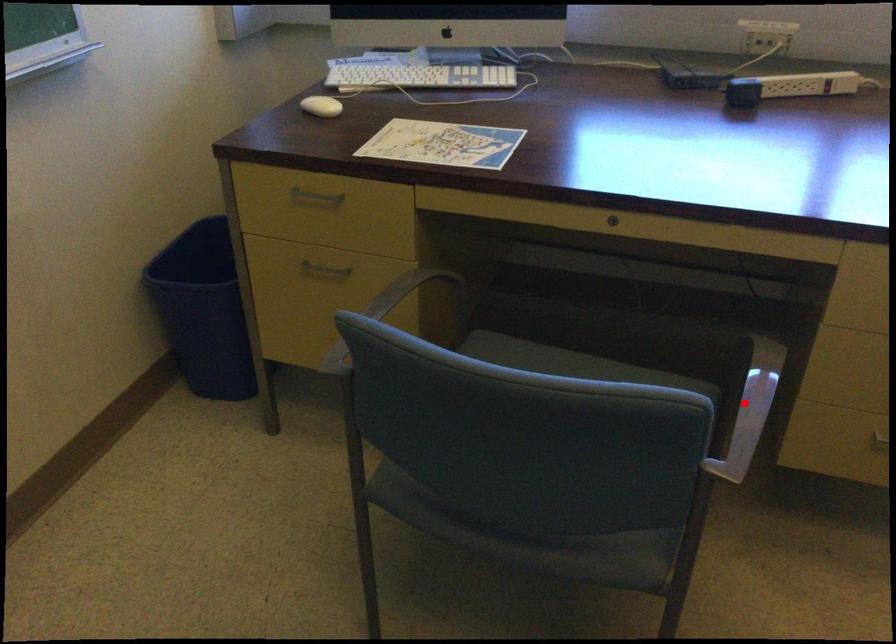
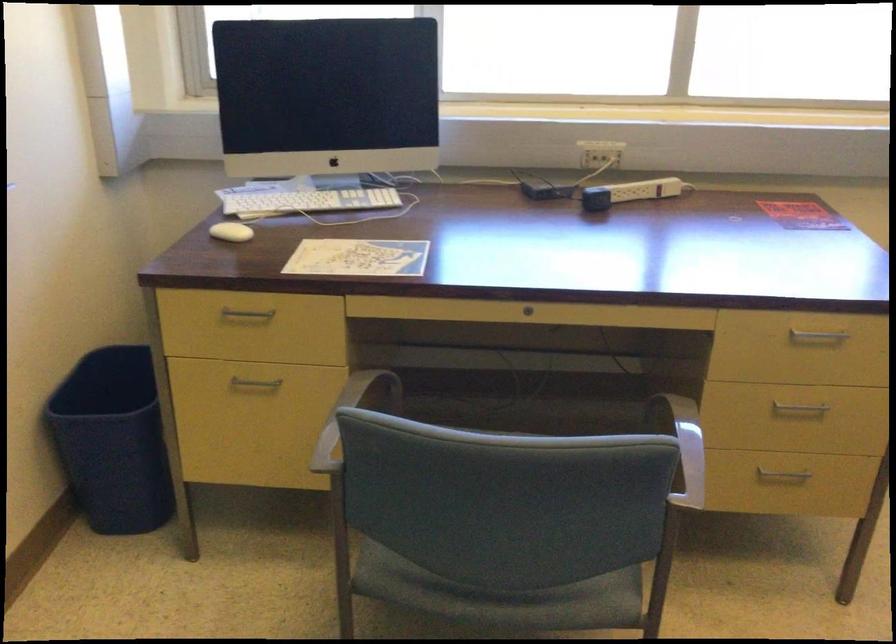
The point at the highlighted location is marked in the first image. Where is the corresponding point in the second image?

(684, 446)